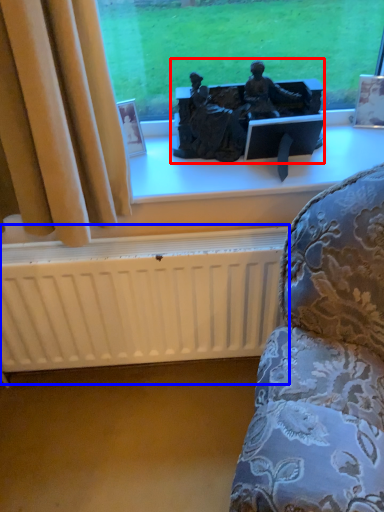
Question: Which of the following is the closest to the observer, sculpture (highlighted by a red box) or radiator (highlighted by a blue box)?

Choices:
 (A) sculpture
 (B) radiator

Answer: (A)